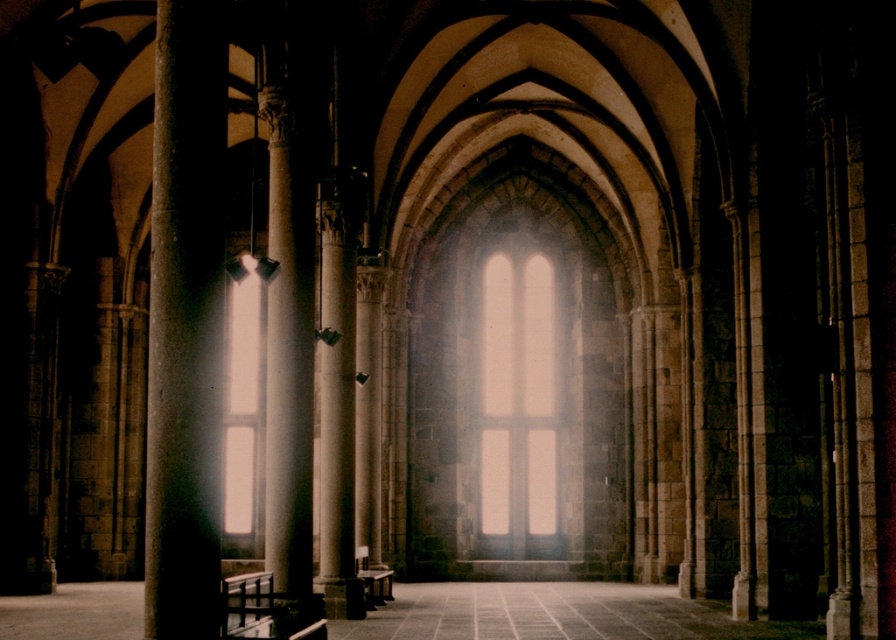
You are an architect examining the interior of this historic building. You notice the smooth stone pillar at left and the white marble column at center. Which object is located higher up in the scene?

The smooth stone pillar at left is positioned over the white marble column at center, meaning it is higher up in the scene.